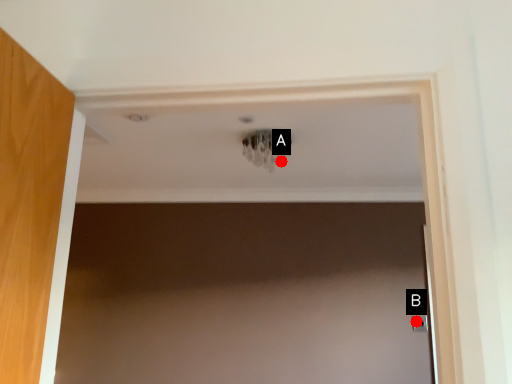
Question: Two points are circled on the image, labeled by A and B beside each circle. Which point is closer to the camera?

Choices:
 (A) A is closer
 (B) B is closer

Answer: (A)